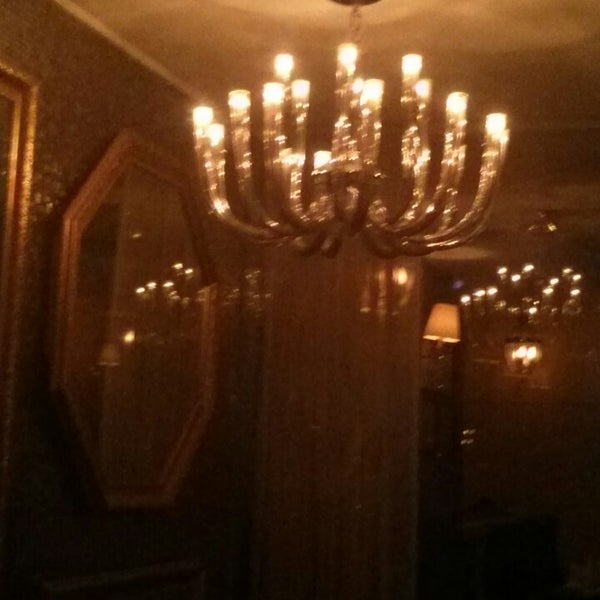
Where is `mirror`? mirror is located at coordinates click(98, 270).